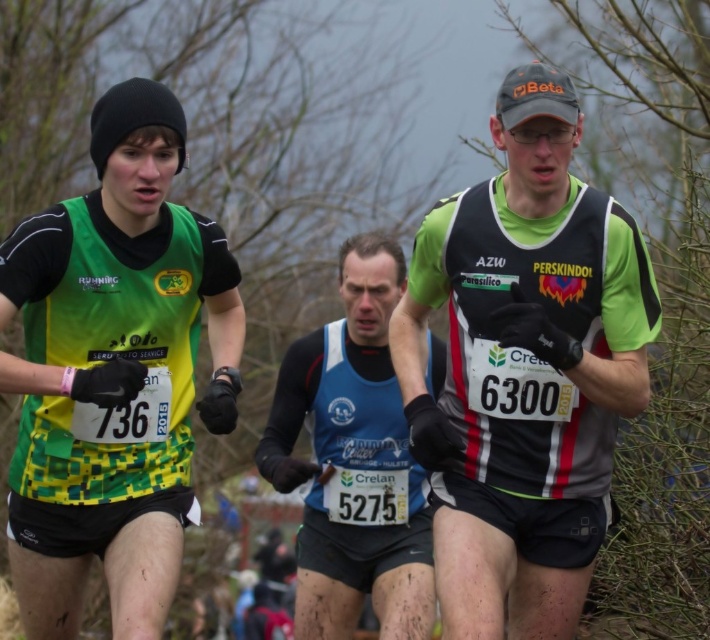
Question: Can you confirm if green/yellow mesh vest at left is positioned to the right of blue fabric running vest at center?

Choices:
 (A) no
 (B) yes

Answer: (A)

Question: Is green jersey at center behind blue fabric running vest at center?

Choices:
 (A) no
 (B) yes

Answer: (A)

Question: Which point is closer to the camera?

Choices:
 (A) (591, 304)
 (B) (337, 488)

Answer: (A)

Question: Is green jersey at center to the right of green/yellow mesh vest at left from the viewer's perspective?

Choices:
 (A) no
 (B) yes

Answer: (B)

Question: Which is nearer to the green/yellow mesh vest at left?

Choices:
 (A) green jersey at center
 (B) blue fabric running vest at center

Answer: (A)

Question: Based on their relative distances, which object is nearer to the green jersey at center?

Choices:
 (A) green/yellow mesh vest at left
 (B) blue fabric running vest at center

Answer: (A)